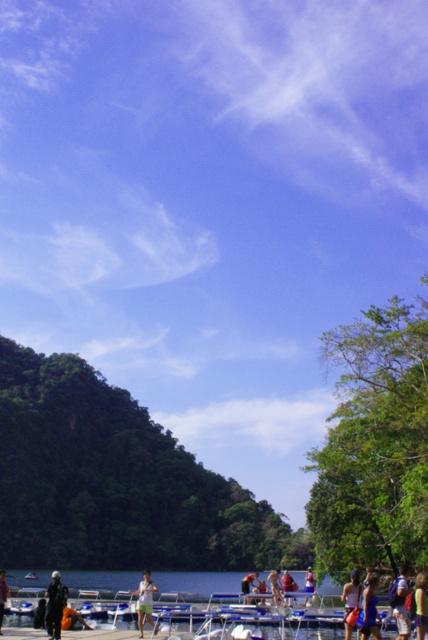
Question: Does green fabric shorts at center lie behind light blue fabric shirt at center?

Choices:
 (A) no
 (B) yes

Answer: (A)

Question: Which point is closer to the camera?

Choices:
 (A) (368, 614)
 (B) (394, 604)
 (C) (244, 577)

Answer: (A)

Question: Is green fabric dress at lower right wider than light brown fabric shirt at center?

Choices:
 (A) yes
 (B) no

Answer: (B)

Question: Which point appears closest to the camera in this image?

Choices:
 (A) (50, 636)
 (B) (312, 579)

Answer: (A)

Question: Which object is farther from the camera taking this photo?

Choices:
 (A) red fabric person at lower center
 (B) yellow fabric backpack at lower right
 (C) clear water at lower center
 (D) light blue fabric shirt at center

Answer: (C)

Question: Can you confirm if yellow fabric backpack at lower right is positioned above light brown fabric shirt at center?

Choices:
 (A) no
 (B) yes

Answer: (B)